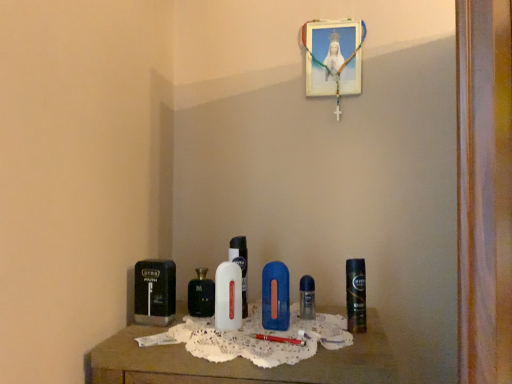
Where is `free space in front of clear plastic perfume at center, which appears as the first perfume when viewed from the right`? Image resolution: width=512 pixels, height=384 pixels. free space in front of clear plastic perfume at center, which appears as the first perfume when viewed from the right is located at coordinates (298, 336).